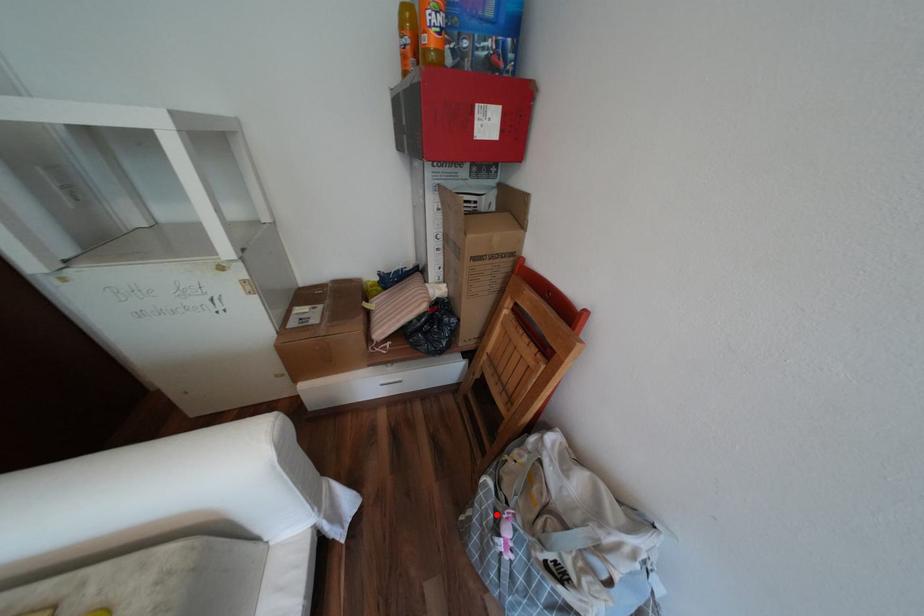
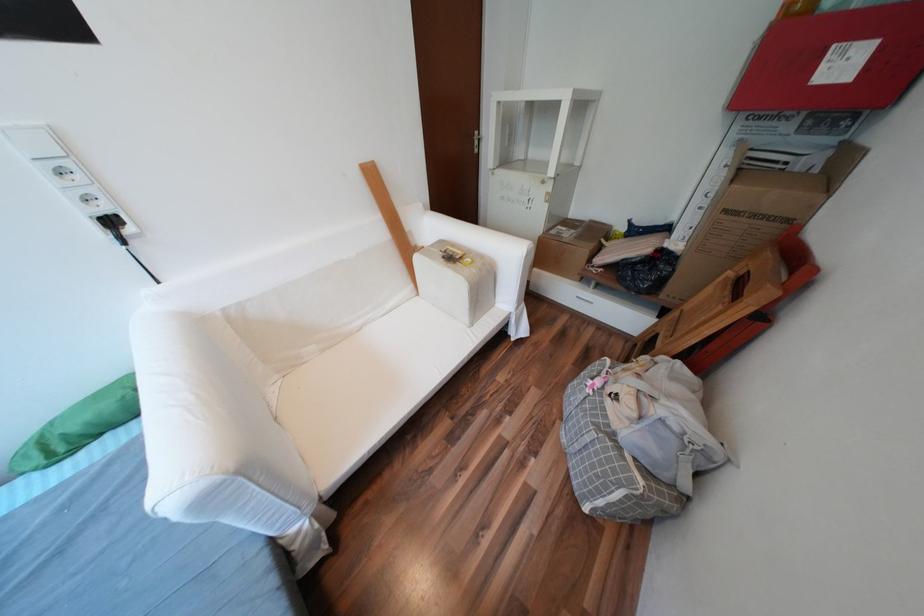
Question: I am providing you with two images of the same scene from different viewpoints. Image1 has a red point marked. In image2, the corresponding 3D location appears at what relative position? Reply with the corresponding letter.

Choices:
 (A) Closer
 (B) Farther

Answer: (A)